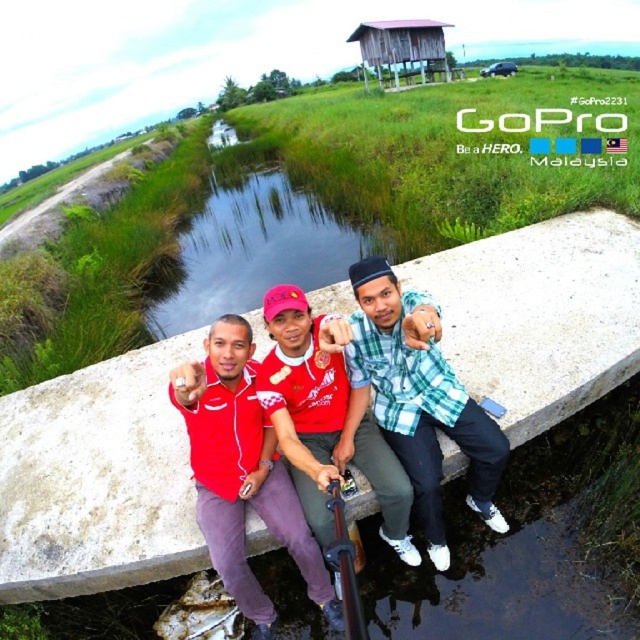
You are a photographer trying to capture a photo of the checkered fabric shirt at center and the wooden stilt house at upper center. Which object will appear larger in the photo?

The wooden stilt house at upper center will appear larger in the photo because it is taller than the checkered fabric shirt at center.

You are a photographer trying to capture a photo of the red fabric shirt at center and the wooden stilt house at upper center. Which object should you zoom in on to make them appear the same size in your photo?

To make the red fabric shirt at center and the wooden stilt house at upper center appear the same size in the photo, you should zoom in on the wooden stilt house at upper center since it is larger than the red fabric shirt at center.